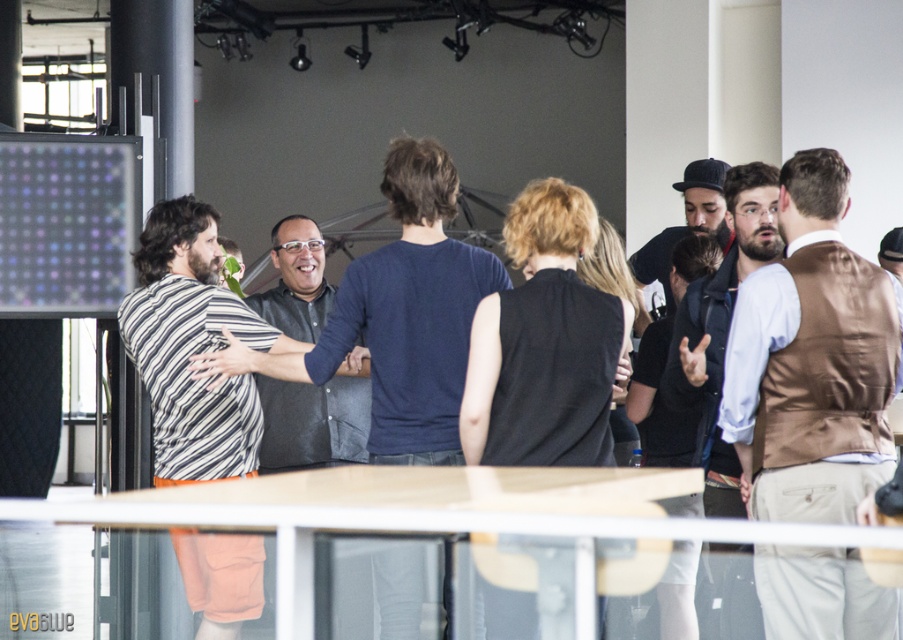
You are a photographer at the event and need to position two vests for a photo shoot. The brown satin vest at right and the brown textured vest at right must be arranged side by side. Which vest should you place on the lower shelf to ensure proper visibility of both?

The brown satin vest at right is shorter than the brown textured vest at right, so placing it on the lower shelf will ensure both vests are visible.

You are a photographer setting up for a group photo. You notice the brown satin vest at right and the dark gray shirt at center. Which clothing item should you focus on first if you want to capture the wider one in your frame?

The brown satin vest at right might be wider than the dark gray shirt at center, so you should focus on the brown satin vest at right first to ensure it fits within the frame.

You are at a social event and see two people dressed in brown textured vest at right and dark gray shirt at center. Which person is positioned more to the right side of the scene?

The brown textured vest at right is positioned more to the right side of the scene compared to the dark gray shirt at center.